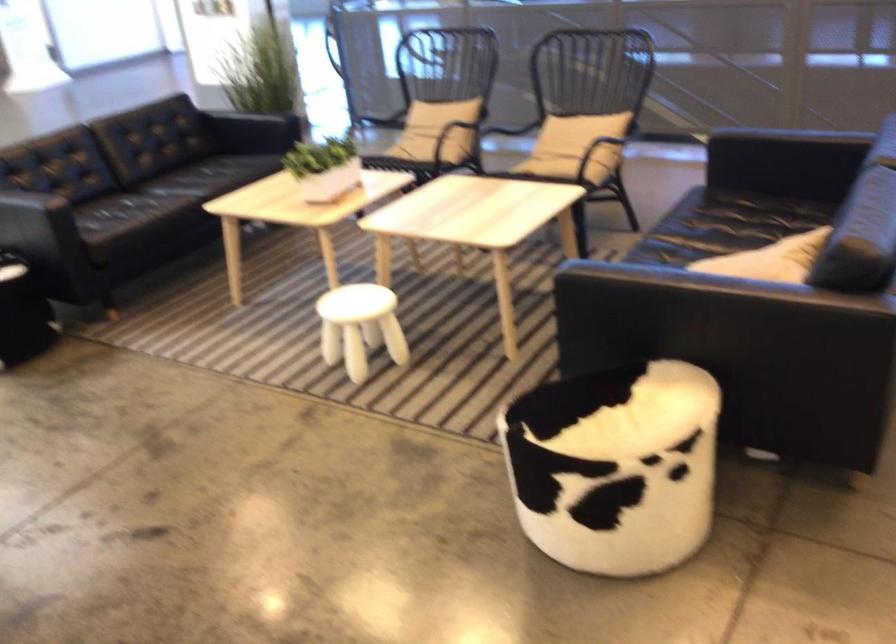
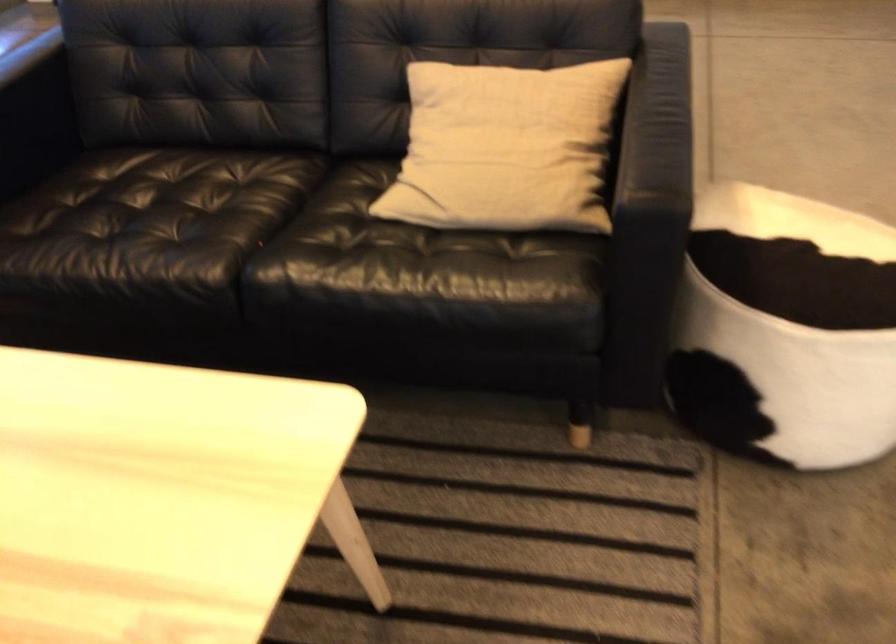
In the second image, find the point that corresponds to the point at 566,389 in the first image.

(786, 330)